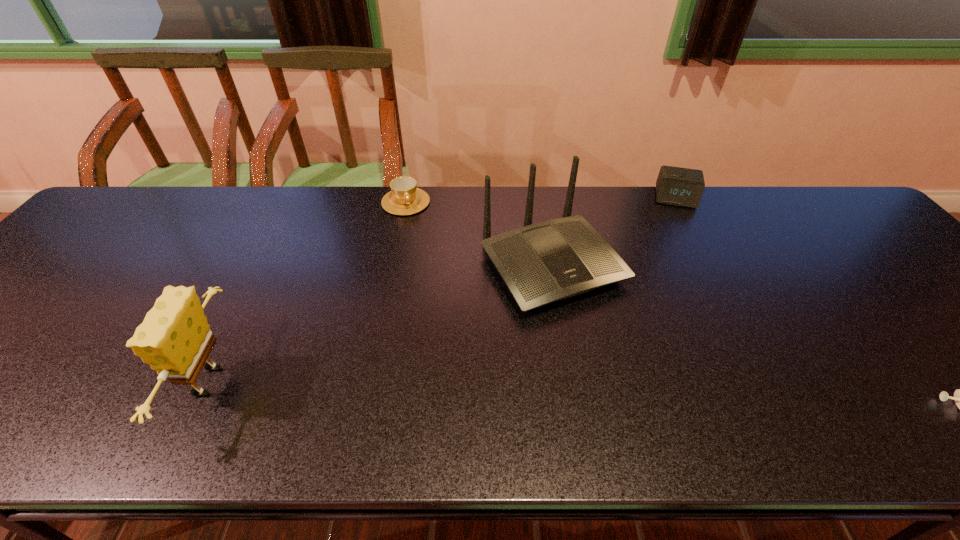
Identify the location of the leftmost object. The image size is (960, 540). click(x=175, y=339).

You are a GUI agent. You are given a task and a screenshot of the screen. Output one action in this format:
    pyautogui.click(x=<x>, y=<y>)
    Task: Click on the cup
    The width and height of the screenshot is (960, 540).
    Given the screenshot: What is the action you would take?
    pyautogui.click(x=405, y=198)

Image resolution: width=960 pixels, height=540 pixels. I want to click on the second object from left to right, so click(x=405, y=198).

Image resolution: width=960 pixels, height=540 pixels. In order to click on the third object from right to left in this screenshot , I will do `click(541, 263)`.

Where is `router`? router is located at coordinates (541, 263).

Identify the location of the fourth object from left to right. The height and width of the screenshot is (540, 960). (677, 186).

The width and height of the screenshot is (960, 540). Identify the location of the third tallest object. (677, 186).

Locate an element on the screen. The width and height of the screenshot is (960, 540). free region located on the face of the leftmost object is located at coordinates (11, 382).

The height and width of the screenshot is (540, 960). Find the location of `vacant space located 0.160m on the face of the leftmost object`. vacant space located 0.160m on the face of the leftmost object is located at coordinates (103, 382).

The width and height of the screenshot is (960, 540). In order to click on blank space located 0.090m on the face of the leftmost object in this screenshot , I will do `click(136, 382)`.